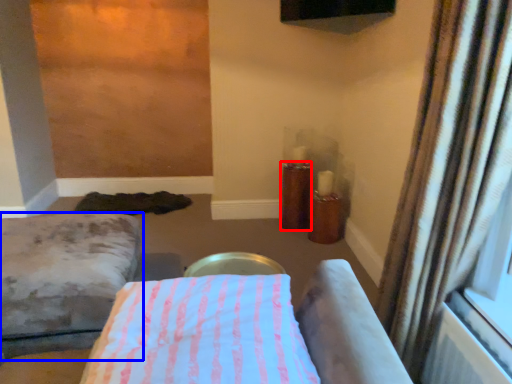
Question: Among these objects, which one is nearest to the camera, candle holder (highlighted by a red box) or furniture (highlighted by a blue box)?

Choices:
 (A) candle holder
 (B) furniture

Answer: (B)